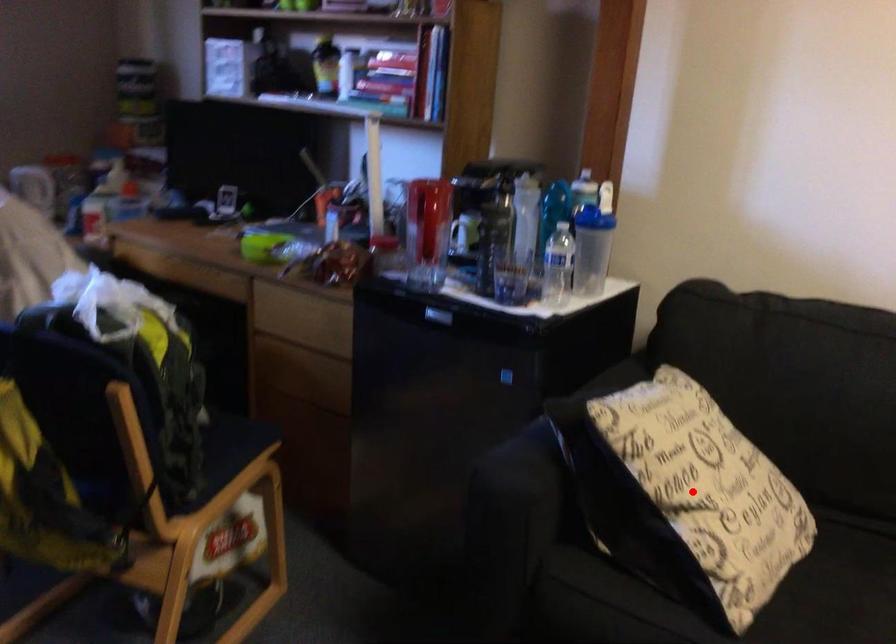
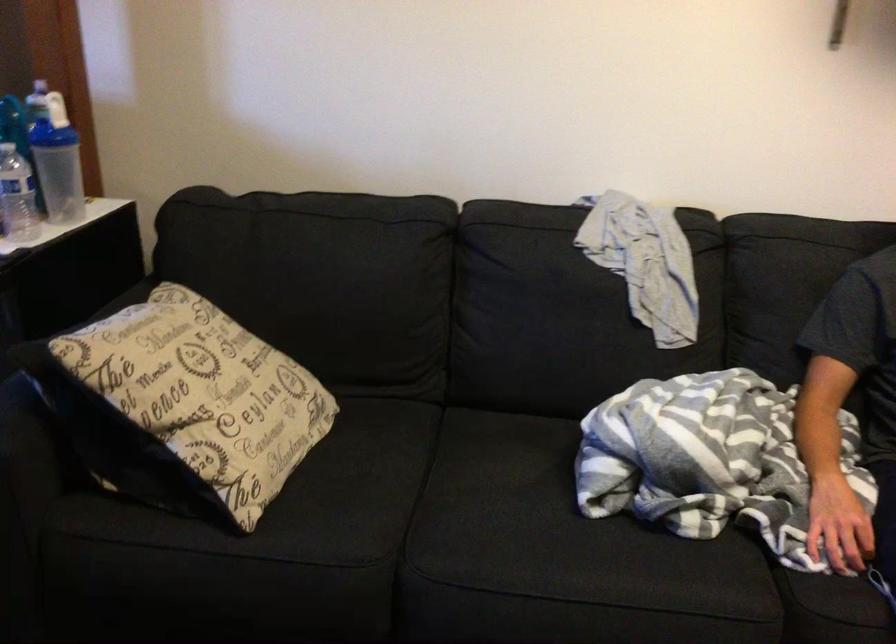
In the second image, find the point that corresponds to the highlighted location in the first image.

(186, 406)